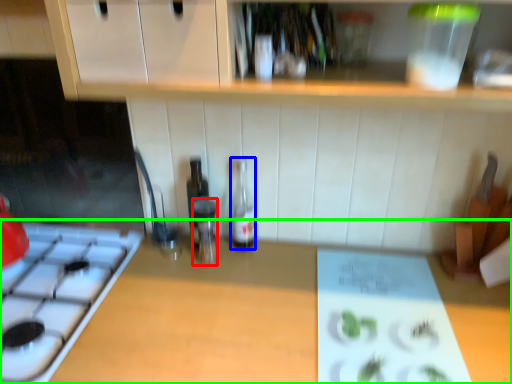
Question: Estimate the real-world distances between objects in this image. Which object is farther from bottle (highlighted by a red box), bottle (highlighted by a blue box) or countertop (highlighted by a green box)?

Choices:
 (A) bottle
 (B) countertop

Answer: (B)